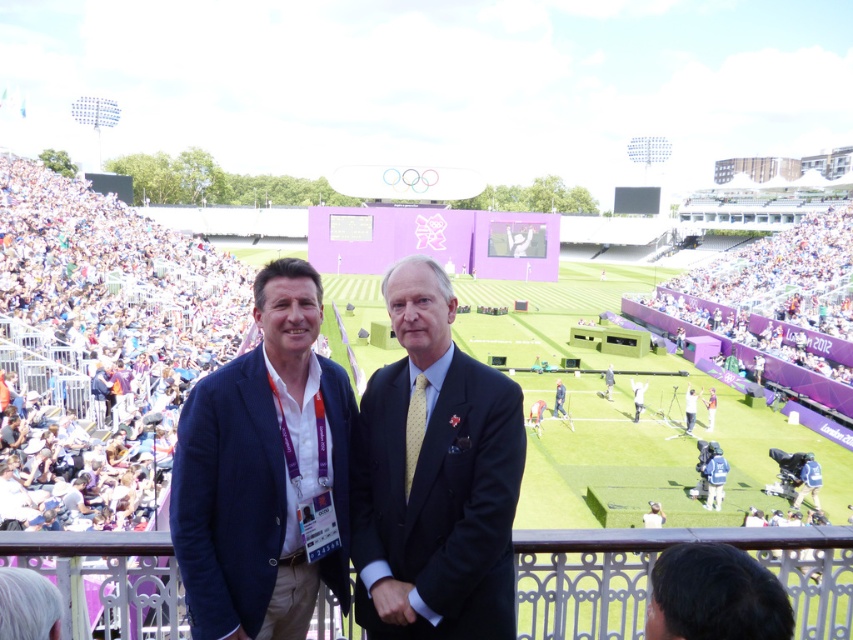
Question: Does dark blue suit at center come in front of light blue suit at center?

Choices:
 (A) yes
 (B) no

Answer: (A)

Question: Is navy blue suit at center wider than light blue suit at center?

Choices:
 (A) yes
 (B) no

Answer: (A)

Question: Which point is farther from the camera taking this photo?

Choices:
 (A) (560, 378)
 (B) (701, 564)
 (C) (285, 310)
 (D) (425, 339)

Answer: (A)

Question: Estimate the real-world distances between objects in this image. Which object is closer to the navy blue suit at center?

Choices:
 (A) multicolored fabric crowd at left
 (B) light blue suit at center

Answer: (A)

Question: Which of these objects is positioned closest to the dark brown hair at lower right?

Choices:
 (A) multicolored fabric crowd at left
 (B) navy blue suit at center
 (C) dark blue suit at center

Answer: (C)

Question: Can you confirm if multicolored fabric crowd at left is positioned to the left of light blue suit at center?

Choices:
 (A) no
 (B) yes

Answer: (B)